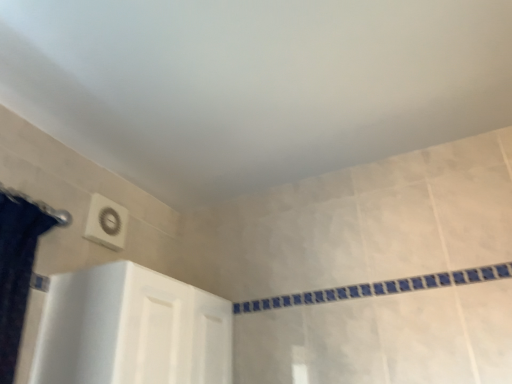
This screenshot has width=512, height=384. What are the coordinates of `white matte cabinet at lower left` in the screenshot? It's located at (131, 329).

The image size is (512, 384). Describe the element at coordinates (131, 329) in the screenshot. I see `white matte cabinet at lower left` at that location.

I want to click on white matte cabinet at lower left, so [x=131, y=329].